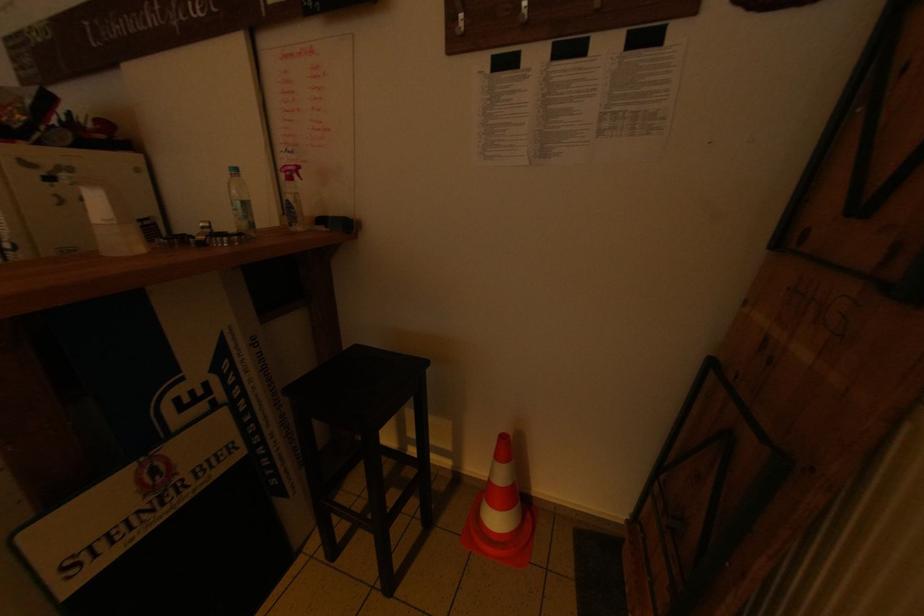
The height and width of the screenshot is (616, 924). What are the coordinates of `orange traffic cone` in the screenshot? It's located at (501, 514).